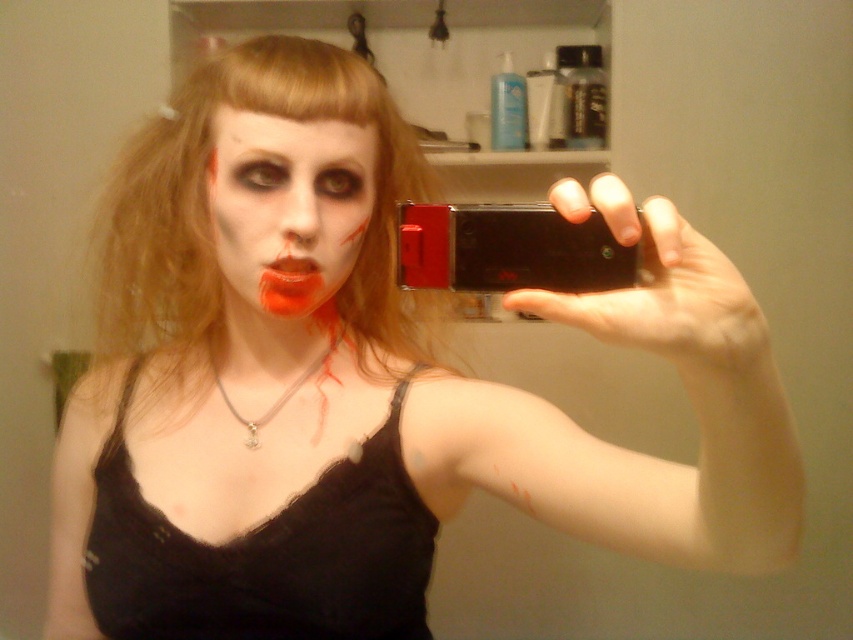
You are a photographer trying to capture the perfect selfie. You notice the blondehair at center and the matte orange lips at center in the frame. Which one is located to the right side of the other?

The blondehair at center is positioned on the left side of matte orange lips at center, so the matte orange lips at center is to the right of the blondehair at center.

You are a photographer trying to capture a closeup shot of the blondehair at center and the matte orange lips at center in the bathroom scene. Given the camera you have can only focus on objects within 25 centimeters, will both subjects be in focus?

The distance between the blondehair at center and the matte orange lips at center is 25.98 centimeters, which exceeds the camera focus range of 25 centimeters. Therefore, both subjects cannot be in focus simultaneously.